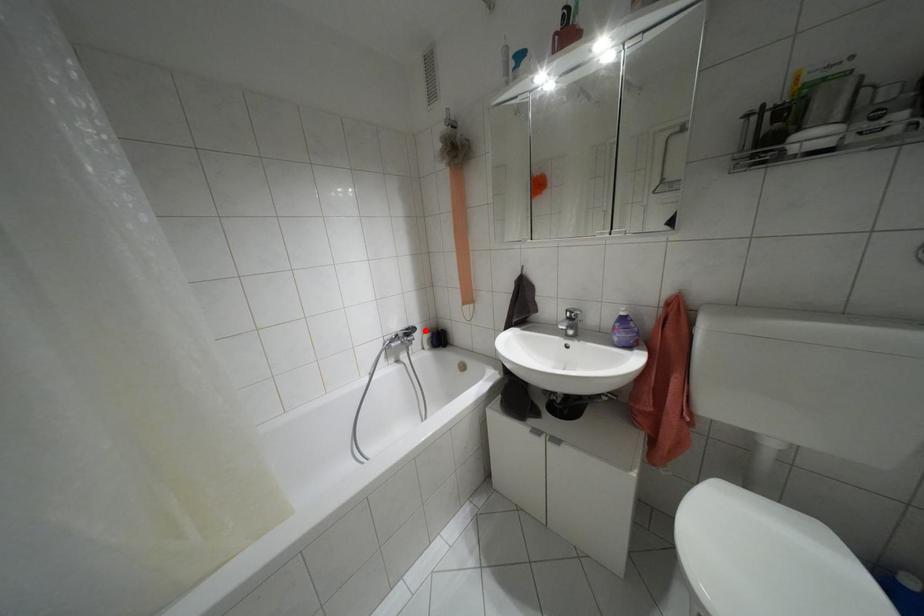
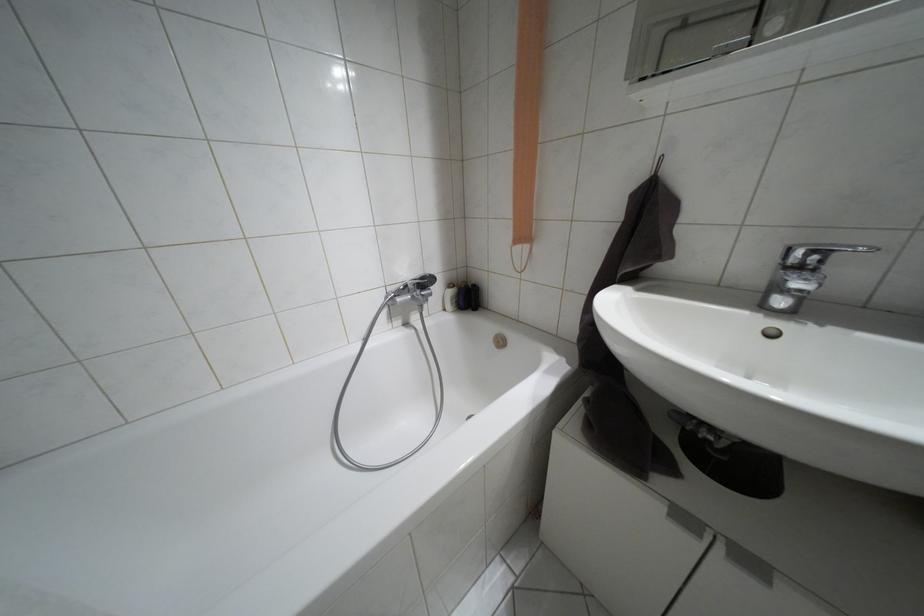
In the second image, find the point that corresponds to the highlighted location in the first image.

(448, 285)